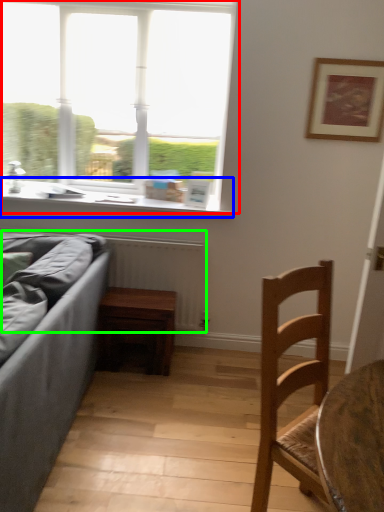
Question: Considering the real-world distances, which object is closest to window (highlighted by a red box)? window sill (highlighted by a blue box) or radiator (highlighted by a green box).

Choices:
 (A) window sill
 (B) radiator

Answer: (A)